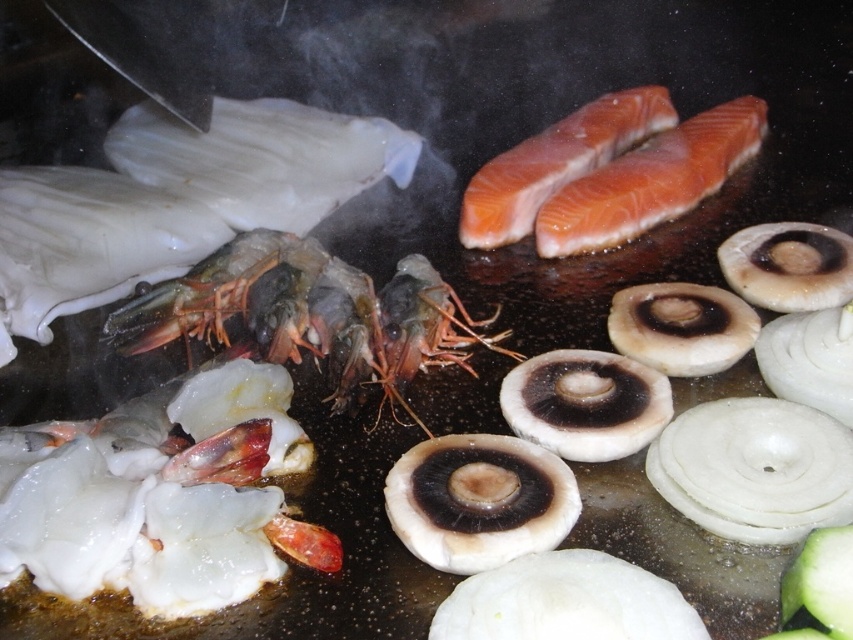
You are a chef preparing a dish and need to arrange ingredients on a dark cast iron surface. You have the translucent white shrimp at lower left and the shiny red prawns at center. Based on their positions in the image, which ingredient is closer to the edge of the cooking surface?

The translucent white shrimp at lower left is closer to the edge of the cooking surface because it is positioned below the shiny red prawns at center, indicating it is lower on the surface.